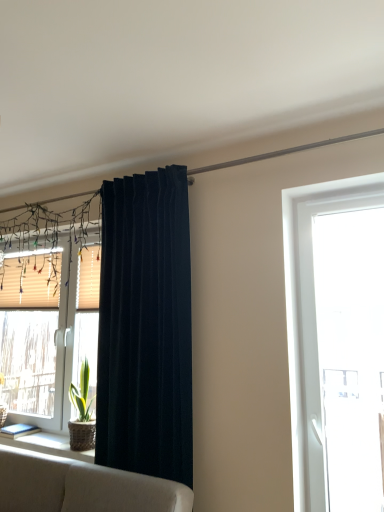
Question: Considering the relative positions of transparent glass door at right, which appears as the second window when viewed from the back, and dark blue velvet curtain at center in the image provided, is transparent glass door at right, which appears as the second window when viewed from the back, behind dark blue velvet curtain at center?

Choices:
 (A) no
 (B) yes

Answer: (A)

Question: Is transparent glass door at right, which appears as the second window when viewed from the back, taller than dark blue velvet curtain at center?

Choices:
 (A) no
 (B) yes

Answer: (A)

Question: Could you tell me if transparent glass door at right, acting as the second window starting from the left, is facing dark blue velvet curtain at center?

Choices:
 (A) no
 (B) yes

Answer: (A)

Question: From a real-world perspective, is transparent glass door at right, which is the 1th window from front to back, under dark blue velvet curtain at center?

Choices:
 (A) yes
 (B) no

Answer: (A)

Question: From the image's perspective, would you say transparent glass door at right, the 1th window positioned from the right, is shown under dark blue velvet curtain at center?

Choices:
 (A) yes
 (B) no

Answer: (A)

Question: Considering the positions of dark blue velvet curtain at center and beige textured shutter at left, the first shutter positioned from the front, in the image, is dark blue velvet curtain at center wider or thinner than beige textured shutter at left, the first shutter positioned from the front,?

Choices:
 (A) thin
 (B) wide

Answer: (B)

Question: Do you think dark blue velvet curtain at center is within beige textured shutter at left, marked as the 2th shutter in a back-to-front arrangement, or outside of it?

Choices:
 (A) outside
 (B) inside

Answer: (A)

Question: Considering the positions of dark blue velvet curtain at center and beige textured shutter at left, which is the 2th shutter in left-to-right order, in the image, is dark blue velvet curtain at center taller or shorter than beige textured shutter at left, which is the 2th shutter in left-to-right order,?

Choices:
 (A) tall
 (B) short

Answer: (A)

Question: From a real-world perspective, relative to beige textured shutter at left, the first shutter positioned from the front, is dark blue velvet curtain at center vertically above or below?

Choices:
 (A) below
 (B) above

Answer: (A)

Question: Is beige textured blinds at left, acting as the first window starting from the back, inside or outside of beige textured shutter at left, marked as the 2th shutter in a back-to-front arrangement?

Choices:
 (A) outside
 (B) inside

Answer: (A)

Question: From the image's perspective, is beige textured blinds at left, which appears as the second window when viewed from the right, above or below beige textured shutter at left, acting as the first shutter starting from the right?

Choices:
 (A) below
 (B) above

Answer: (A)

Question: From a real-world perspective, is beige textured blinds at left, the second window in the front-to-back sequence, physically located above or below beige textured shutter at left, acting as the first shutter starting from the right?

Choices:
 (A) below
 (B) above

Answer: (A)

Question: Is point (46, 252) positioned closer to the camera than point (92, 306)?

Choices:
 (A) closer
 (B) farther

Answer: (B)

Question: From a real-world perspective, is beige textured shutter at left, marked as the 2th shutter in a back-to-front arrangement, positioned above or below beige wood shutter at left, the 1th shutter when ordered from left to right?

Choices:
 (A) below
 (B) above

Answer: (B)

Question: Does point (94, 266) appear closer or farther from the camera than point (31, 295)?

Choices:
 (A) farther
 (B) closer

Answer: (B)